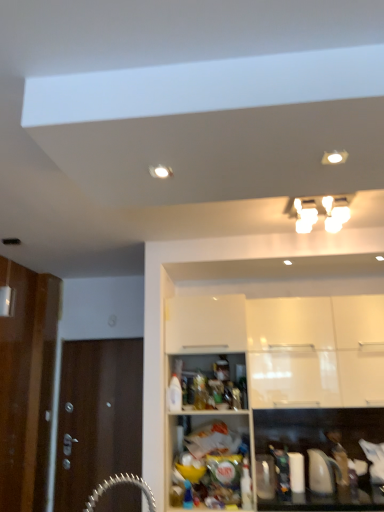
Question: From a real-world perspective, does white glossy light fixture at upper center stand above white glossy cabinet at upper right, arranged as the 2th cabinetry when viewed from the front?

Choices:
 (A) yes
 (B) no

Answer: (A)

Question: From the image's perspective, is white glossy light fixture at upper center located above white glossy cabinet at upper right, which is the first cabinetry from back to front?

Choices:
 (A) yes
 (B) no

Answer: (A)

Question: Is white glossy light fixture at upper center located outside white glossy cabinet at upper right, which is the first cabinetry from back to front?

Choices:
 (A) no
 (B) yes

Answer: (B)

Question: Is white glossy light fixture at upper center further to camera compared to white glossy cabinet at upper right, arranged as the 2th cabinetry when viewed from the front?

Choices:
 (A) yes
 (B) no

Answer: (B)

Question: Is white glossy light fixture at upper center with white glossy cabinet at upper right, which is the first cabinetry from back to front?

Choices:
 (A) no
 (B) yes

Answer: (A)

Question: From a real-world perspective, is translucent plastic bottle at center above or below white glossy light fixture at upper center?

Choices:
 (A) below
 (B) above

Answer: (A)

Question: Is translucent plastic bottle at center taller or shorter than white glossy light fixture at upper center?

Choices:
 (A) short
 (B) tall

Answer: (B)

Question: From the image's perspective, is translucent plastic bottle at center located above or below white glossy light fixture at upper center?

Choices:
 (A) above
 (B) below

Answer: (B)

Question: Looking at the image, does translucent plastic bottle at center seem bigger or smaller compared to white glossy light fixture at upper center?

Choices:
 (A) big
 (B) small

Answer: (B)

Question: Is white glossy cabinet at upper right, arranged as the 2th cabinetry when viewed from the front, inside the boundaries of brown wooden door at left, or outside?

Choices:
 (A) inside
 (B) outside

Answer: (B)

Question: Is point (x=327, y=362) positioned closer to the camera than point (x=92, y=355)?

Choices:
 (A) farther
 (B) closer

Answer: (B)

Question: Considering the positions of white glossy cabinet at upper right, which is the first cabinetry from back to front, and brown wooden door at left in the image, is white glossy cabinet at upper right, which is the first cabinetry from back to front, taller or shorter than brown wooden door at left?

Choices:
 (A) short
 (B) tall

Answer: (A)

Question: From a real-world perspective, is white glossy cabinet at upper right, which is the first cabinetry from back to front, positioned above or below brown wooden door at left?

Choices:
 (A) below
 (B) above

Answer: (B)

Question: Considering the relative positions of brown wooden door at left and white glossy cabinet at upper center, the second cabinetry viewed from the back, in the image provided, is brown wooden door at left to the left or to the right of white glossy cabinet at upper center, the second cabinetry viewed from the back,?

Choices:
 (A) left
 (B) right

Answer: (A)

Question: From the image's perspective, relative to white glossy cabinet at upper center, the second cabinetry viewed from the back, is brown wooden door at left above or below?

Choices:
 (A) above
 (B) below

Answer: (B)